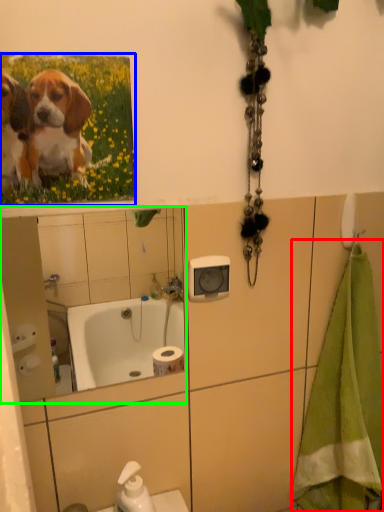
Question: Which object is the closest to the bath towel (highlighted by a red box)? Choose among these: flower (highlighted by a blue box) or mirror (highlighted by a green box).

Choices:
 (A) flower
 (B) mirror

Answer: (A)